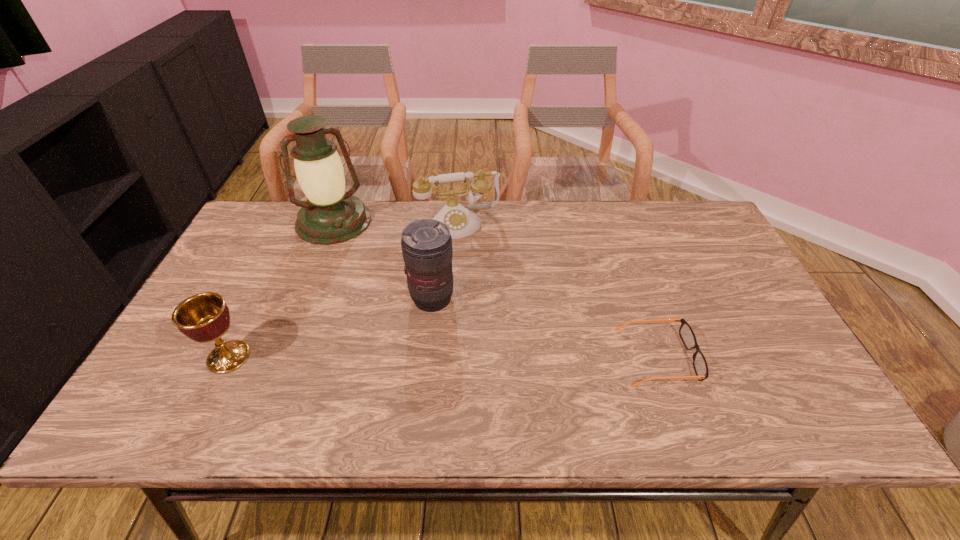
Image resolution: width=960 pixels, height=540 pixels. I want to click on free spot on the desktop that is between the chalice and the spectacles and is positioned on the side of the third farthest object where the control switches are located, so click(x=483, y=357).

Where is `vacant spot on the desktop that is between the chalice and the shortest object and is positioned on the dial of the telephone`? Image resolution: width=960 pixels, height=540 pixels. vacant spot on the desktop that is between the chalice and the shortest object and is positioned on the dial of the telephone is located at coordinates (497, 357).

Where is `free space on the desktop that is between the chalice and the shortest object and is positioned with the light compartment facing forward on the tallest object`? This screenshot has height=540, width=960. free space on the desktop that is between the chalice and the shortest object and is positioned with the light compartment facing forward on the tallest object is located at coordinates click(393, 357).